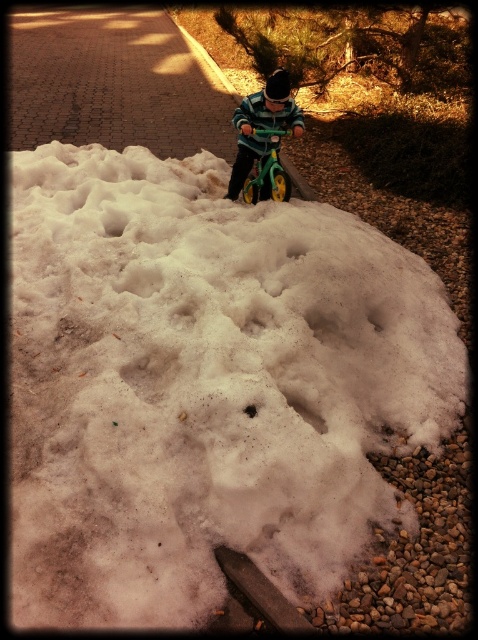
You are an observer standing in the scene. You notice the white fluffy snow at center and the striped sweater at center. Which object is wider?

The white fluffy snow at center is wider than the striped sweater at center.